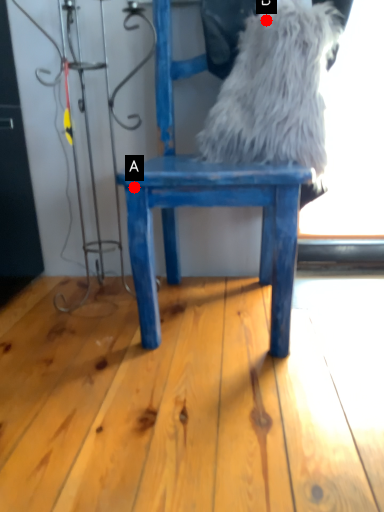
Question: Two points are circled on the image, labeled by A and B beside each circle. Which point is farther to the camera?

Choices:
 (A) A is further
 (B) B is further

Answer: (B)